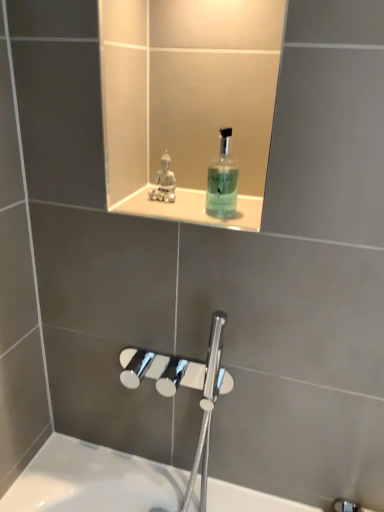
Identify the location of vacant space to the left of translucent glass mouthwash at upper center. The width and height of the screenshot is (384, 512). (164, 211).